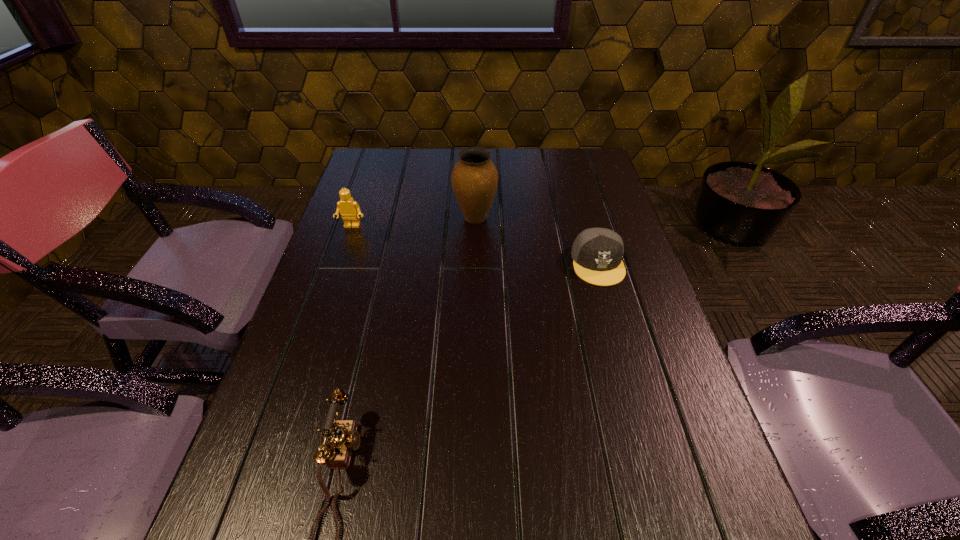
At what (x,y) coordinates should I click in order to perform the action: click on the tallest object. Please return your answer as a coordinate pair (x, y). Looking at the image, I should click on (474, 179).

Image resolution: width=960 pixels, height=540 pixels. What are the coordinates of `urn` in the screenshot? It's located at (474, 179).

Identify the location of Lego. Image resolution: width=960 pixels, height=540 pixels. (348, 208).

The height and width of the screenshot is (540, 960). Find the location of `the third farthest object`. the third farthest object is located at coordinates (597, 253).

In order to click on the rightmost object in this screenshot , I will do `click(597, 253)`.

Where is `vacant space located on the left of the tallest object`? Image resolution: width=960 pixels, height=540 pixels. vacant space located on the left of the tallest object is located at coordinates (405, 218).

At what (x,y) coordinates should I click in order to perform the action: click on vacant space positioned on the face of the Lego. Please return your answer as a coordinate pair (x, y). The height and width of the screenshot is (540, 960). Looking at the image, I should click on (334, 278).

This screenshot has height=540, width=960. I want to click on vacant space located on the front-facing side of the shortest object, so (x=638, y=406).

You are a GUI agent. You are given a task and a screenshot of the screen. Output one action in this format:
    pyautogui.click(x=<x>, y=<y>)
    Task: Click on the object at the left edge
    The image size is (960, 540).
    Given the screenshot: What is the action you would take?
    pyautogui.click(x=348, y=208)

Locate an element on the screen. The height and width of the screenshot is (540, 960). object at the right edge is located at coordinates pos(597,253).